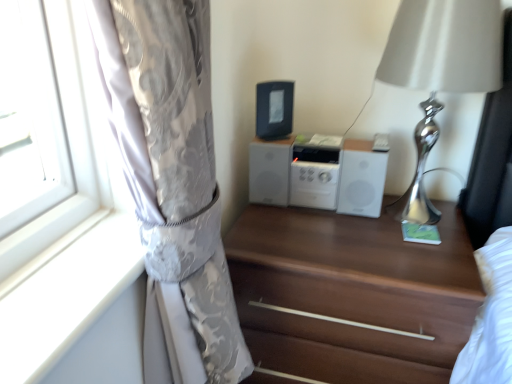
At what (x,y) coordinates should I click in order to perform the action: click on free space on the front side of silver metallic table lamp at right. Please return your answer as a coordinate pair (x, y). Looking at the image, I should click on (419, 266).